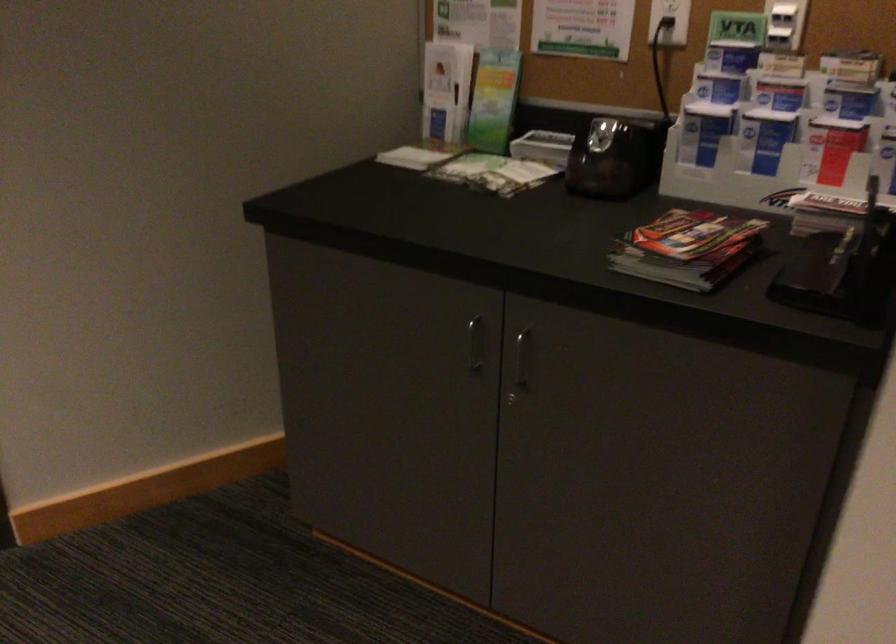
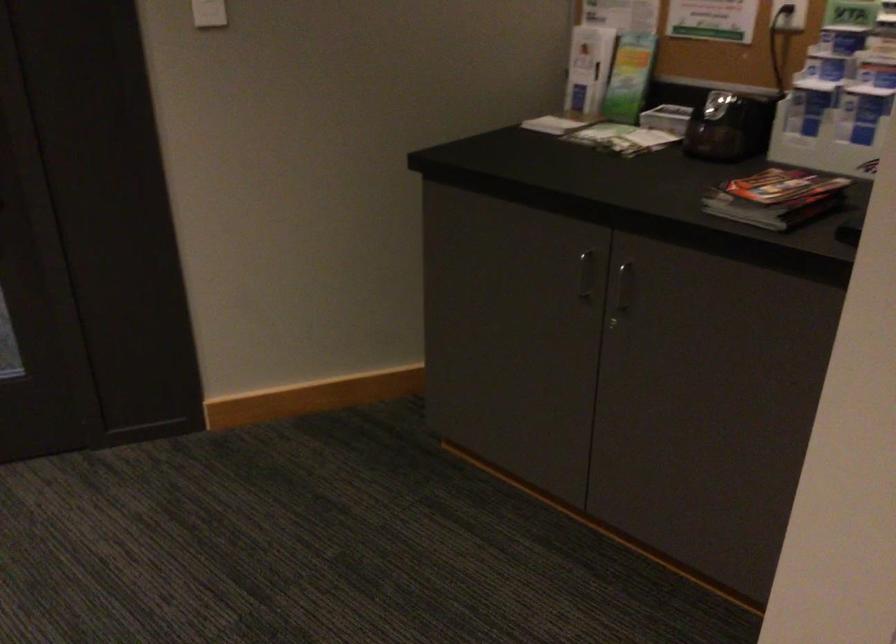
The point at (695, 249) is marked in the first image. Where is the corresponding point in the second image?

(776, 198)